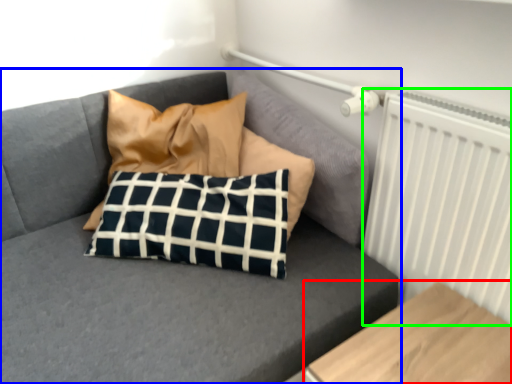
Question: Estimate the real-world distances between objects in this image. Which object is farther from furniture (highlighted by a red box), studio couch (highlighted by a blue box) or radiator (highlighted by a green box)?

Choices:
 (A) studio couch
 (B) radiator

Answer: (A)